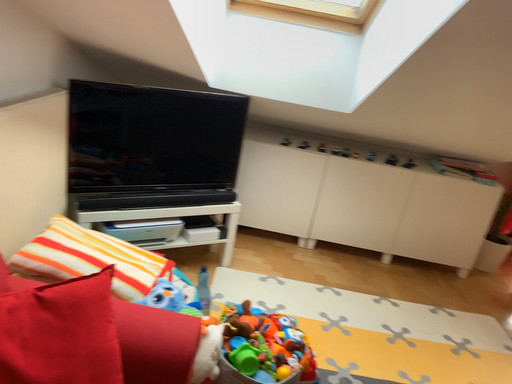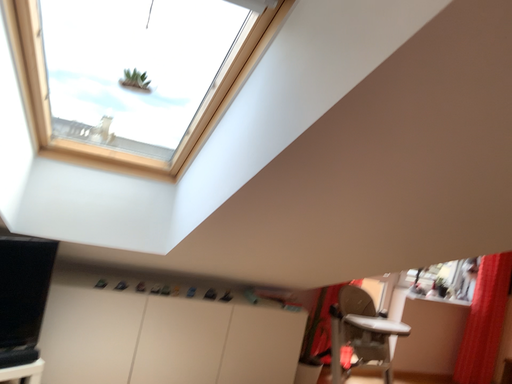
Question: How did the camera likely rotate when shooting the video?

Choices:
 (A) rotated downward
 (B) rotated upward

Answer: (B)